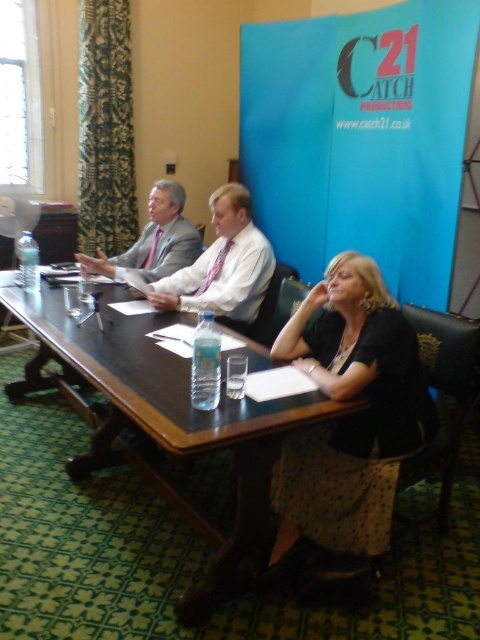
Question: Is dark wood table at center wider than black textured blouse at center?

Choices:
 (A) no
 (B) yes

Answer: (B)

Question: Which point is farther from the camera taking this photo?

Choices:
 (A) 171,435
 (B) 230,273

Answer: (B)

Question: Estimate the real-world distances between objects in this image. Which object is closer to the matte pink tie at center?

Choices:
 (A) black textured blouse at center
 (B) dark wood table at center
 (C) matte gray suit at center

Answer: (C)

Question: In this image, where is matte pink tie at center located relative to matte gray suit at center?

Choices:
 (A) above
 (B) below

Answer: (B)

Question: Does dark wood table at center have a greater width compared to matte pink tie at center?

Choices:
 (A) no
 (B) yes

Answer: (B)

Question: Which is farther from the black textured blouse at center?

Choices:
 (A) matte pink tie at center
 (B) dark wood table at center
 (C) matte gray suit at center

Answer: (C)